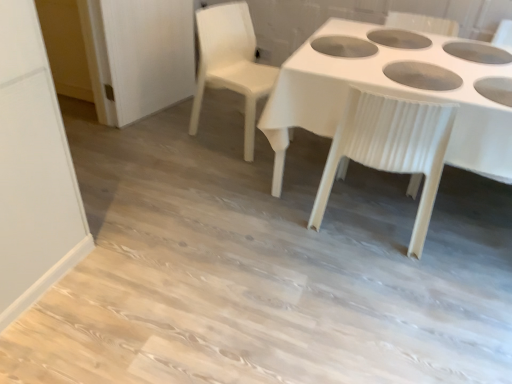
The height and width of the screenshot is (384, 512). What are the coordinates of `vacant space that is to the left of white plastic table at center` in the screenshot? It's located at (180, 203).